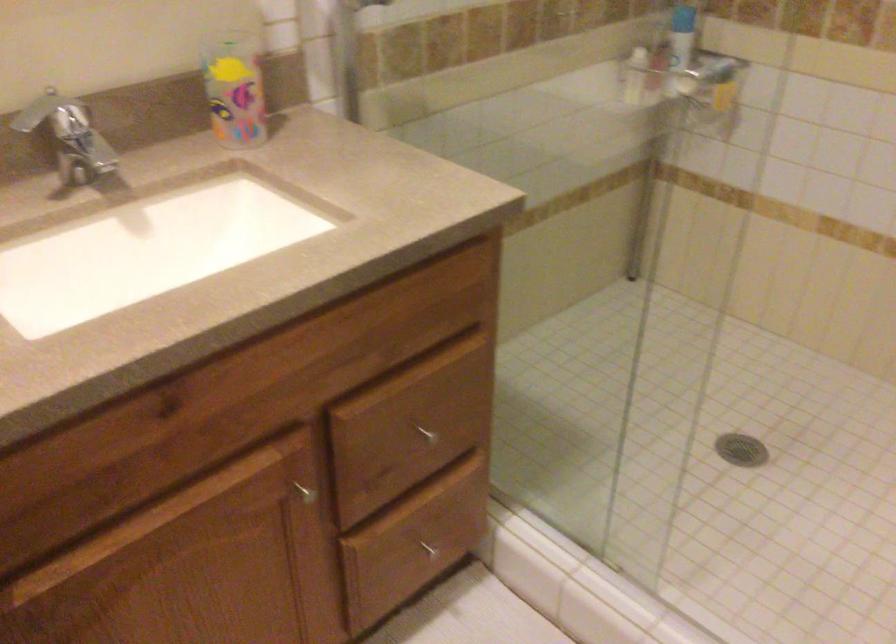
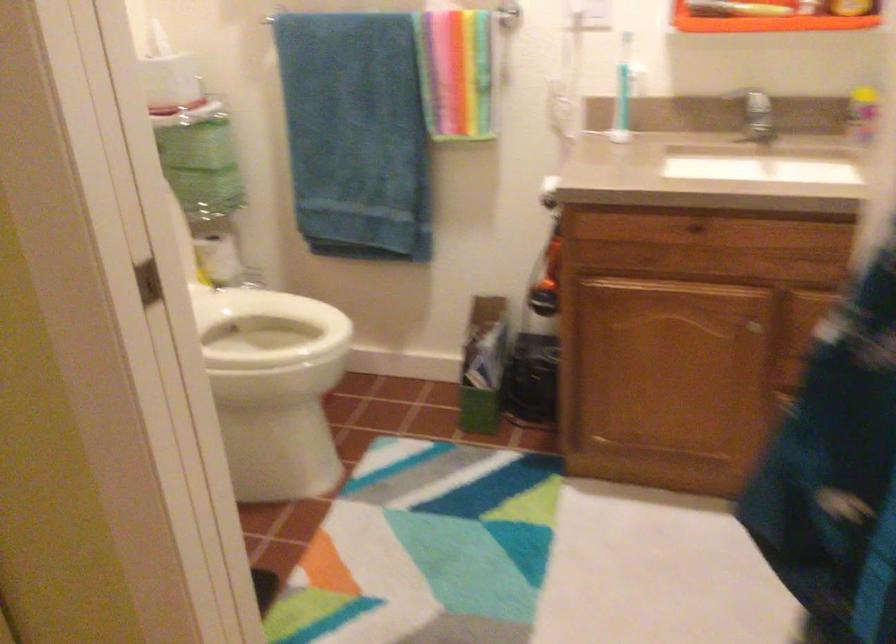
Question: How did the camera likely rotate?

Choices:
 (A) Left
 (B) Right
 (C) Up
 (D) Down

Answer: (A)